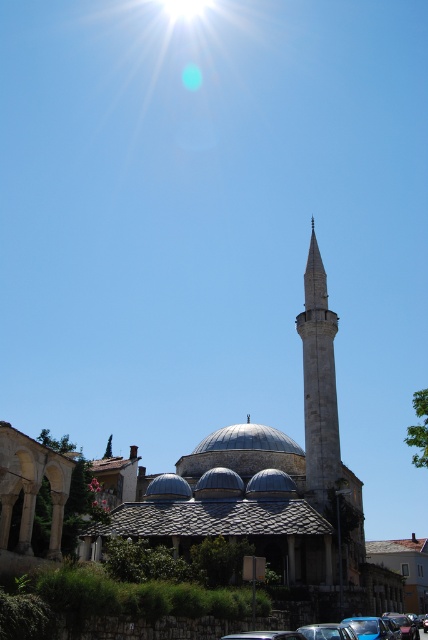
Question: From the image, what is the correct spatial relationship of smooth gray dome at center in relation to metallic silver car at center?

Choices:
 (A) above
 (B) below

Answer: (A)

Question: Considering the real-world distances, which object is farthest from the metallic blue car at lower center?

Choices:
 (A) white stone minaret at center
 (B) smooth gray dome at center
 (C) metallic silver car at center
 (D) blue metallic car at lower center

Answer: (B)

Question: Is smooth gray dome at center wider than blue metallic car at lower center?

Choices:
 (A) yes
 (B) no

Answer: (A)

Question: Which point appears farthest from the camera in this image?

Choices:
 (A) (321, 630)
 (B) (410, 627)
 (C) (376, 634)
 (D) (309, 256)

Answer: (D)

Question: Which point is closer to the camera?

Choices:
 (A) smooth gray dome at center
 (B) metallic silver car at center
 (C) metallic blue car at lower center

Answer: (B)

Question: Does metallic blue car at lower center lie in front of blue metallic car at lower center?

Choices:
 (A) no
 (B) yes

Answer: (B)